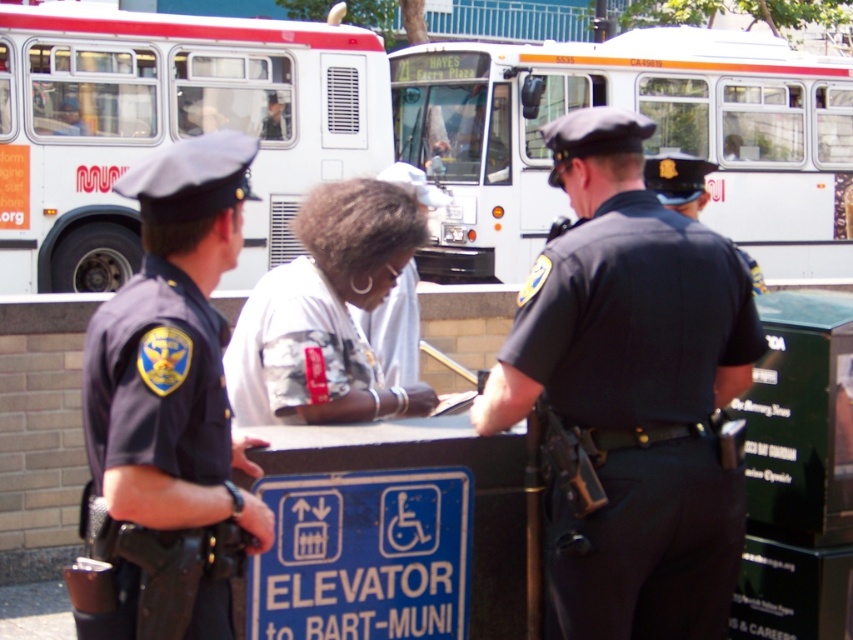
Which is more to the left, dark blue uniform at center or white matte bus at center?

dark blue uniform at center

Can you confirm if dark blue uniform at center is positioned below white matte bus at center?

Yes, dark blue uniform at center is below white matte bus at center.

Between point (579, 396) and point (598, 51), which one is positioned behind?

The point (598, 51) is more distant.

You are a GUI agent. You are given a task and a screenshot of the screen. Output one action in this format:
    pyautogui.click(x=<x>, y=<y>)
    Task: Click on the dark blue uniform at center
    This screenshot has width=853, height=640.
    Given the screenshot: What is the action you would take?
    tap(631, 392)

Can you confirm if white matte bus at upper left is positioned to the right of dark blue uniform at left?

In fact, white matte bus at upper left is to the left of dark blue uniform at left.

Can you confirm if white matte bus at upper left is smaller than dark blue uniform at left?

Actually, white matte bus at upper left might be larger than dark blue uniform at left.

Measure the distance between point (x=93, y=131) and camera.

A distance of 12.85 meters exists between point (x=93, y=131) and camera.

I want to click on white matte bus at upper left, so click(167, 128).

Can you confirm if white matte bus at center is smaller than dark blue uniform at left?

Indeed, white matte bus at center has a smaller size compared to dark blue uniform at left.

Who is positioned more to the left, white matte bus at center or dark blue uniform at left?

dark blue uniform at left

This screenshot has width=853, height=640. I want to click on white matte bus at center, so click(645, 140).